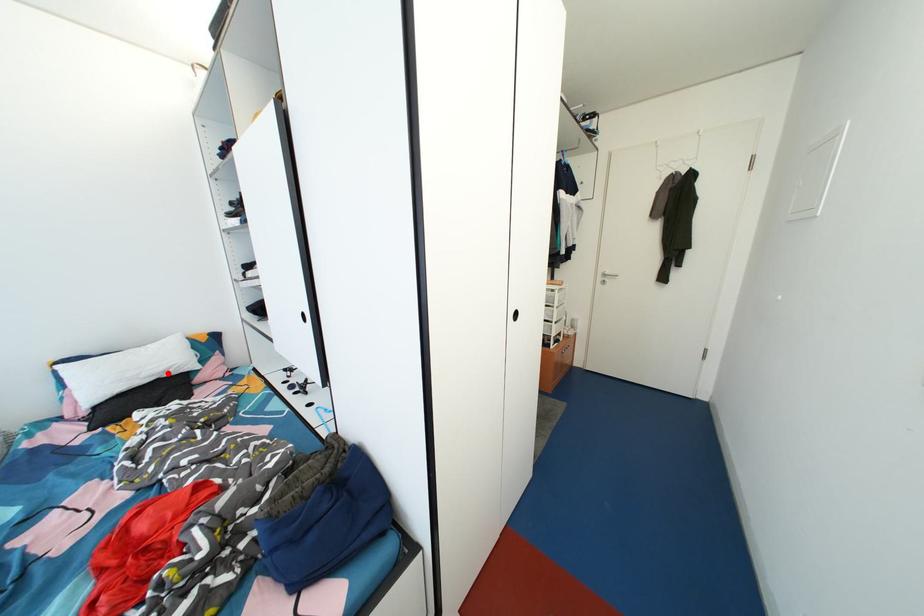
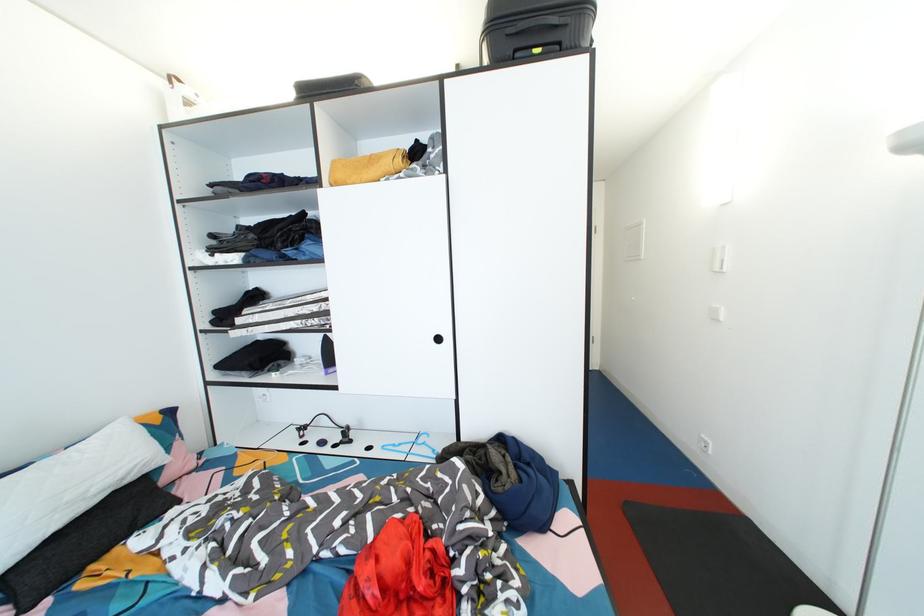
In the second image, find the point that corresponds to the highlighted location in the first image.

(128, 477)